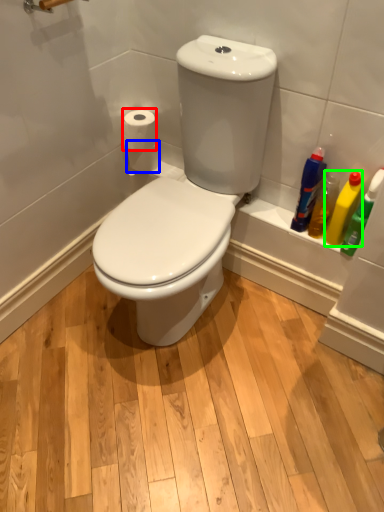
Question: Which object is positioned farthest from toilet paper (highlighted by a red box)? Select from toilet paper (highlighted by a blue box) and cleaning product (highlighted by a green box).

Choices:
 (A) toilet paper
 (B) cleaning product

Answer: (B)